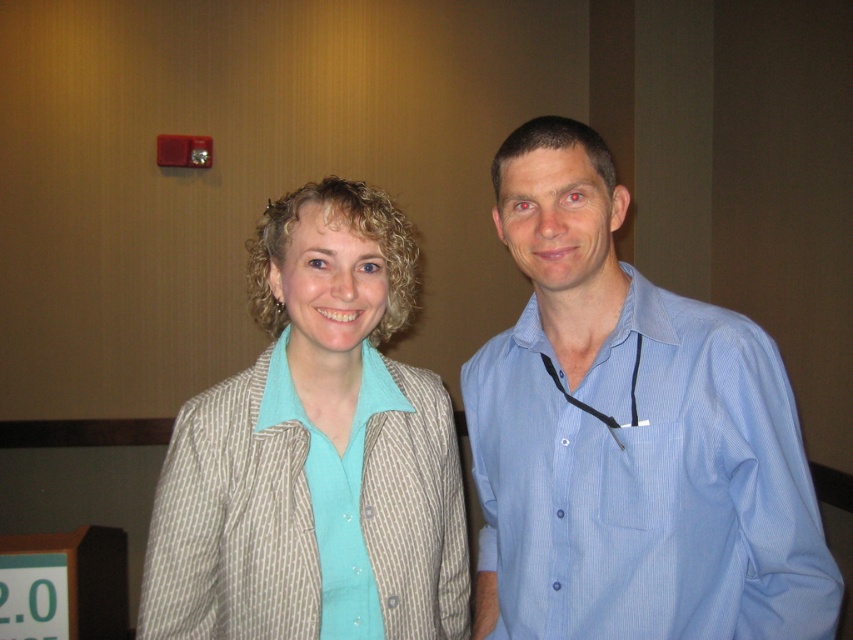
Question: Does blue striped shirt at right come in front of light brown textured blazer at center?

Choices:
 (A) no
 (B) yes

Answer: (B)

Question: Which object appears farthest from the camera in this image?

Choices:
 (A) light brown textured blazer at center
 (B) blue striped shirt at right

Answer: (A)

Question: Is blue striped shirt at right positioned behind light brown textured blazer at center?

Choices:
 (A) yes
 (B) no

Answer: (B)

Question: Which object appears farthest from the camera in this image?

Choices:
 (A) light brown textured blazer at center
 (B) blue striped shirt at right

Answer: (A)

Question: Can you confirm if blue striped shirt at right is positioned to the right of light brown textured blazer at center?

Choices:
 (A) no
 (B) yes

Answer: (B)